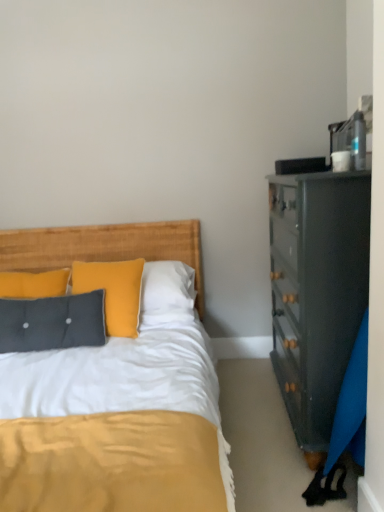
Measure the distance between point (36, 261) and camera.

They are 2.58 meters apart.

Where is `woven wood headboard at center`? The height and width of the screenshot is (512, 384). woven wood headboard at center is located at coordinates (104, 247).

The width and height of the screenshot is (384, 512). What do you see at coordinates (104, 247) in the screenshot?
I see `woven wood headboard at center` at bounding box center [104, 247].

Where is `textured gray pillow at left`? The image size is (384, 512). textured gray pillow at left is located at coordinates (52, 322).

The height and width of the screenshot is (512, 384). What do you see at coordinates (52, 322) in the screenshot? I see `textured gray pillow at left` at bounding box center [52, 322].

Where is `woven wood headboard at center`? Image resolution: width=384 pixels, height=512 pixels. woven wood headboard at center is located at coordinates (104, 247).

Between textured gray pillow at left and woven wood headboard at center, which one appears on the right side from the viewer's perspective?

woven wood headboard at center is more to the right.

Which object is further away from the camera taking this photo, textured gray pillow at left or woven wood headboard at center?

woven wood headboard at center is further away from the camera.

Is point (33, 308) farther from camera compared to point (195, 231)?

No, (33, 308) is in front of (195, 231).

From the image's perspective, between textured gray pillow at left and woven wood headboard at center, who is located below?

From the image's view, textured gray pillow at left is below.

From a real-world perspective, who is located higher, textured gray pillow at left or woven wood headboard at center?

woven wood headboard at center is physically above.

Considering the sizes of objects textured gray pillow at left and woven wood headboard at center in the image provided, who is thinner, textured gray pillow at left or woven wood headboard at center?

woven wood headboard at center.

In the scene shown: Between textured gray pillow at left and woven wood headboard at center, which one has less height?

Standing shorter between the two is textured gray pillow at left.

Can you confirm if textured gray pillow at left is bigger than woven wood headboard at center?

No.

Is textured gray pillow at left not within woven wood headboard at center?

Yes, textured gray pillow at left is located beyond the bounds of woven wood headboard at center.

Would you consider textured gray pillow at left to be distant from woven wood headboard at center?

They are positioned close to each other.

Is textured gray pillow at left turned away from woven wood headboard at center?

No.

The height and width of the screenshot is (512, 384). What are the coordinates of `pillow directly beneath the woven wood headboard at center (from a real-world perspective)` in the screenshot? It's located at (52, 322).

Visually, is woven wood headboard at center positioned to the left or to the right of textured gray pillow at left?

In the image, woven wood headboard at center appears on the right side of textured gray pillow at left.

Between woven wood headboard at center and textured gray pillow at left, which one is positioned in front?

textured gray pillow at left.

Considering the positions of point (162, 234) and point (23, 300), is point (162, 234) closer or farther from the camera than point (23, 300)?

Clearly, point (162, 234) is more distant from the camera than point (23, 300).

From the image's perspective, does woven wood headboard at center appear lower than textured gray pillow at left?

Incorrect, from the image's perspective, woven wood headboard at center is higher than textured gray pillow at left.

From a real-world perspective, which is physically below, woven wood headboard at center or textured gray pillow at left?

textured gray pillow at left.

Is woven wood headboard at center thinner than textured gray pillow at left?

Indeed, woven wood headboard at center has a lesser width compared to textured gray pillow at left.

Can you confirm if woven wood headboard at center is taller than textured gray pillow at left?

Correct, woven wood headboard at center is much taller as textured gray pillow at left.

Who is smaller, woven wood headboard at center or textured gray pillow at left?

textured gray pillow at left is smaller.

Would you say woven wood headboard at center is inside or outside textured gray pillow at left?

woven wood headboard at center cannot be found inside textured gray pillow at left.

Is woven wood headboard at center touching textured gray pillow at left?

woven wood headboard at center is not next to textured gray pillow at left, and they're not touching.

Is woven wood headboard at center looking in the opposite direction of textured gray pillow at left?

No.

Where is `pillow located underneath the woven wood headboard at center (from a real-world perspective)`? Image resolution: width=384 pixels, height=512 pixels. pillow located underneath the woven wood headboard at center (from a real-world perspective) is located at coordinates (52, 322).

Locate an element on the screen. pillow on the left side of woven wood headboard at center is located at coordinates (52, 322).

You are a GUI agent. You are given a task and a screenshot of the screen. Output one action in this format:
    pyautogui.click(x=<x>, y=<y>)
    Task: Click on the pillow in front of the woven wood headboard at center
    The height and width of the screenshot is (512, 384).
    Given the screenshot: What is the action you would take?
    pyautogui.click(x=52, y=322)